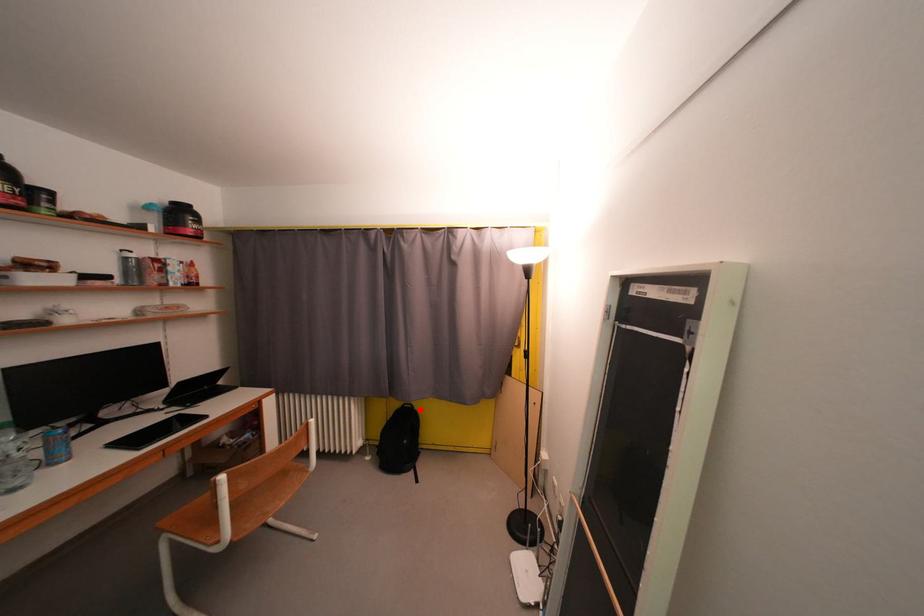
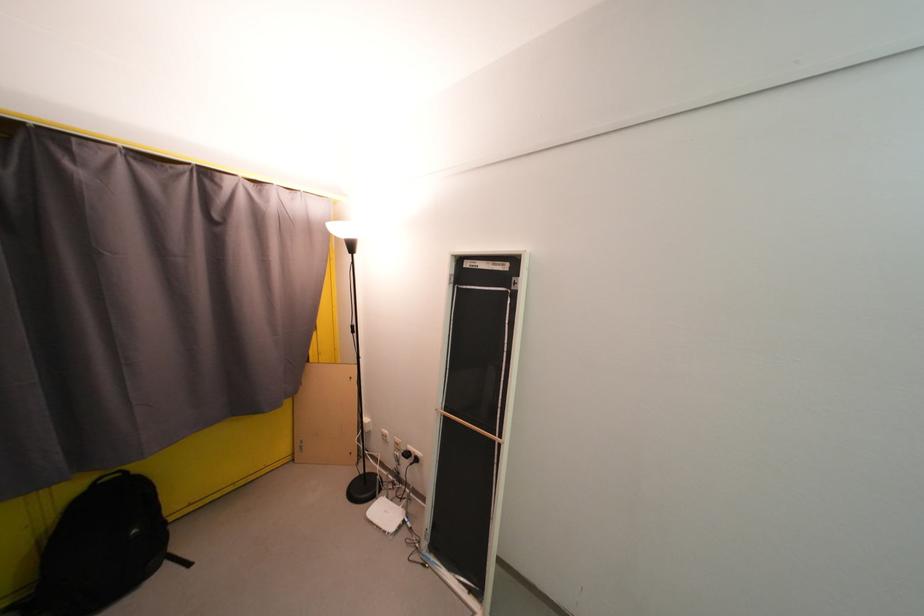
In the second image, find the point that corresponds to the highlighted location in the first image.

(134, 476)